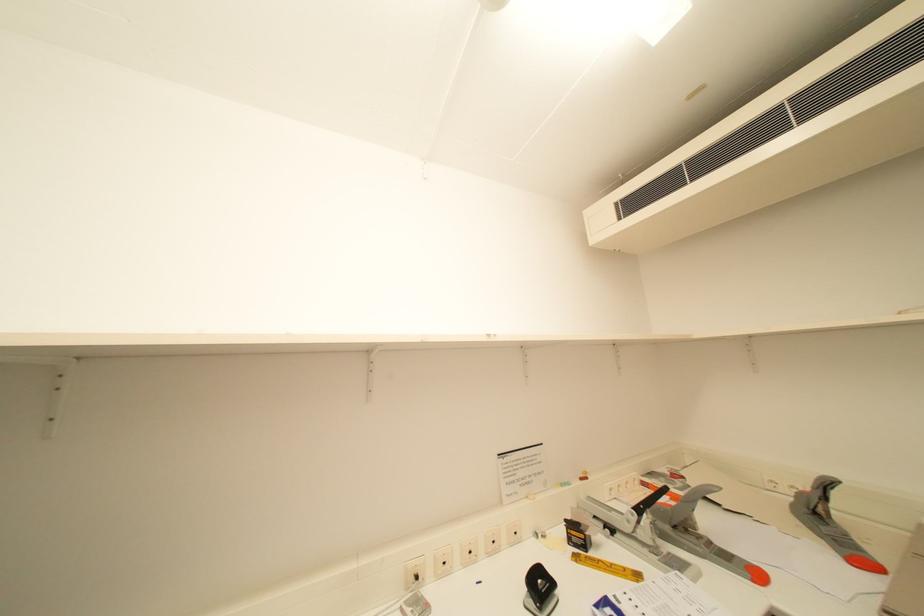
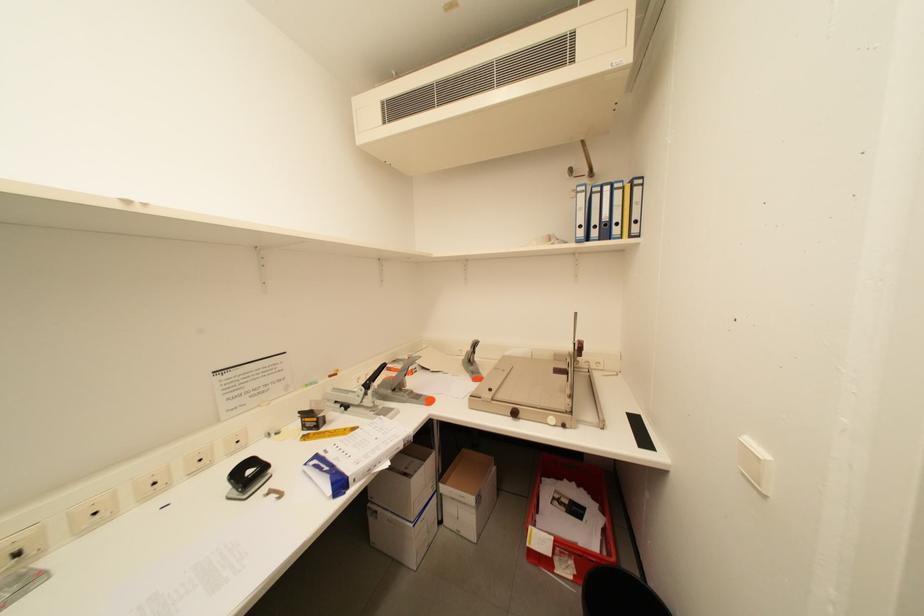
Question: How did the camera likely rotate?

Choices:
 (A) Left
 (B) Right
 (C) Up
 (D) Down

Answer: (B)